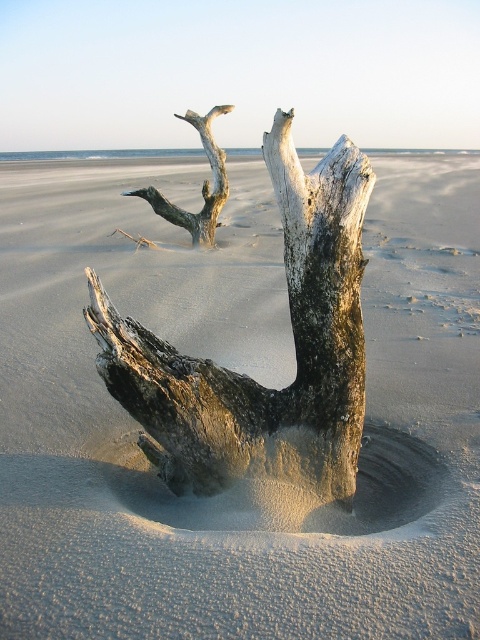
You are a sculptor planning to carve a small statue from the weathered wood driftwood at center and the gray weathered wood at upper center. Which piece of wood is more suitable for creating a detailed sculpture that requires thicker material?

The gray weathered wood at upper center is more suitable because it is thicker than the weathered wood driftwood at center.

You are a photographer planning to capture a wide shot of the beach scene. You need to ensure both the weathered wood driftwood at center and the gray weathered wood at upper center are fully visible in the frame. Given their sizes, which object might require you to adjust your camera angle to include it entirely?

The gray weathered wood at upper center occupies more space than the weathered wood driftwood at center, so it might require adjusting the camera angle to ensure it is fully visible in the frame.

You are a photographer planning to take a photo of the beach scene. You want to ensure both the weathered wood driftwood at center and the gray weathered wood at upper center are fully visible in the frame. Which object should you position closer to the camera to avoid cropping?

To ensure both the weathered wood driftwood at center and the gray weathered wood at upper center are fully visible, position the gray weathered wood at upper center closer to the camera since it is taller than the weathered wood driftwood at center.